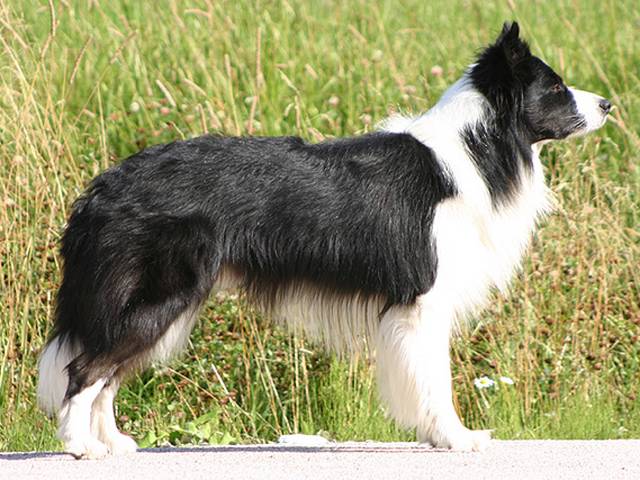
Identify the location of white fur. (476, 256).